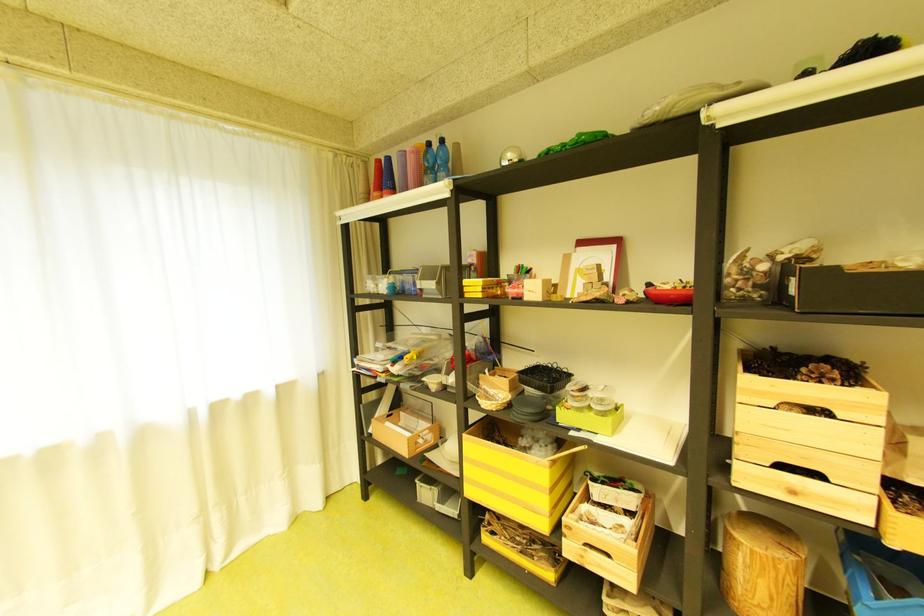
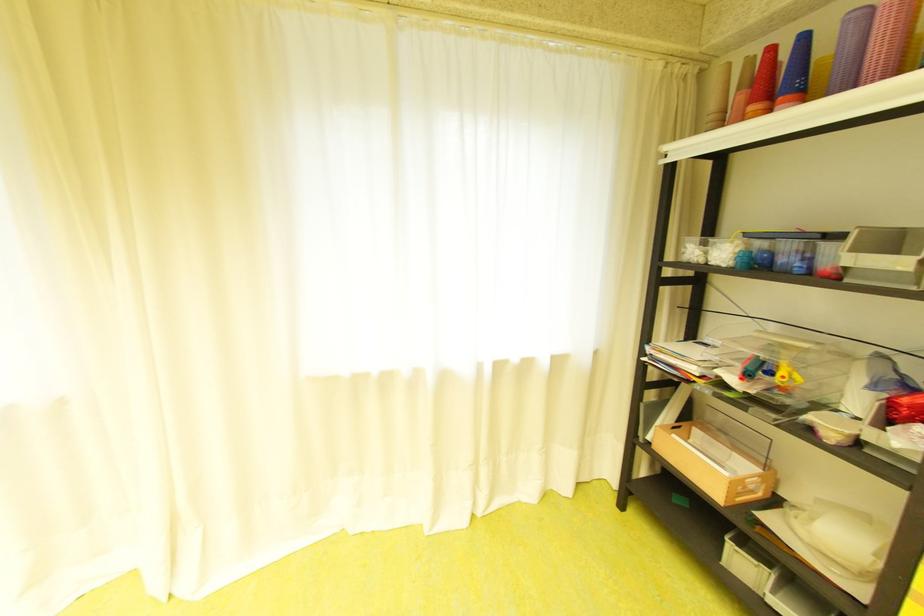
Question: Based on the continuous images, in which direction is the camera rotating? Reply with the corresponding letter.

Choices:
 (A) Left
 (B) Right
 (C) Up
 (D) Down

Answer: (A)